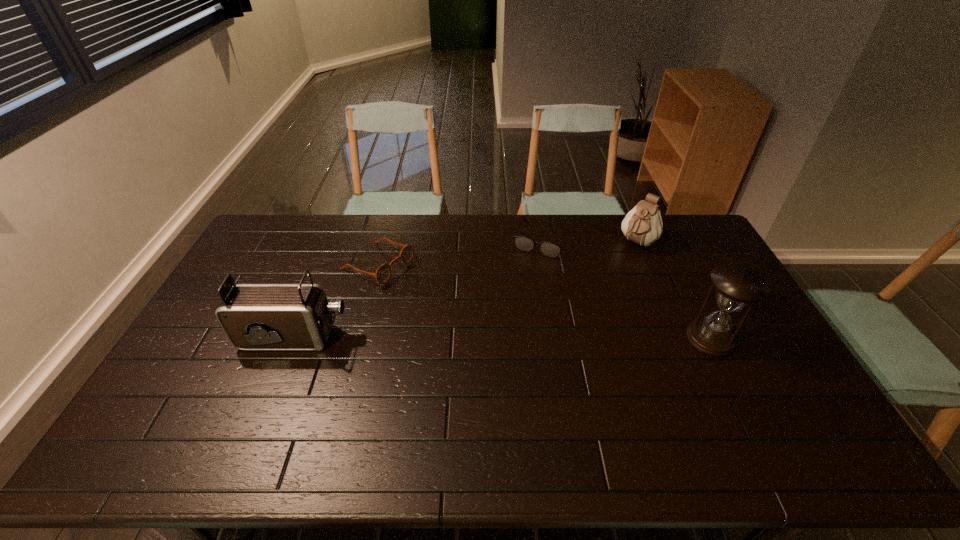
I want to click on vacant position located 0.350m on the front-facing side of the pouch, so click(583, 306).

You are a GUI agent. You are given a task and a screenshot of the screen. Output one action in this format:
    pyautogui.click(x=<x>, y=<y>)
    Task: Click on the vacant space located on the front-facing side of the pouch
    The width and height of the screenshot is (960, 540).
    Given the screenshot: What is the action you would take?
    pyautogui.click(x=588, y=299)

Where is `free space located 0.320m on the front-facing side of the pouch`? This screenshot has width=960, height=540. free space located 0.320m on the front-facing side of the pouch is located at coordinates (588, 301).

Find the location of a particular element. This screenshot has width=960, height=540. vacant space located on the front-facing side of the left spectacles is located at coordinates (434, 291).

At what (x,y) coordinates should I click in order to perform the action: click on vacant space located 0.060m on the front-facing side of the left spectacles. Please return your answer as a coordinate pair (x, y). This screenshot has height=540, width=960. Looking at the image, I should click on (420, 284).

In order to click on vacant area located 0.390m on the front-facing side of the left spectacles in this screenshot , I will do `click(505, 323)`.

Find the location of a particular element. pouch that is at the far edge is located at coordinates (643, 225).

At what (x,y) coordinates should I click in order to perform the action: click on object that is at the left edge. Please return your answer as a coordinate pair (x, y). The height and width of the screenshot is (540, 960). Looking at the image, I should click on (253, 316).

Image resolution: width=960 pixels, height=540 pixels. I want to click on object that is positioned at the right edge, so click(x=736, y=286).

In the image, there is a desktop. At what (x,y) coordinates should I click in order to perform the action: click on vacant space at the far edge. Please return your answer as a coordinate pair (x, y). Image resolution: width=960 pixels, height=540 pixels. Looking at the image, I should click on click(573, 247).